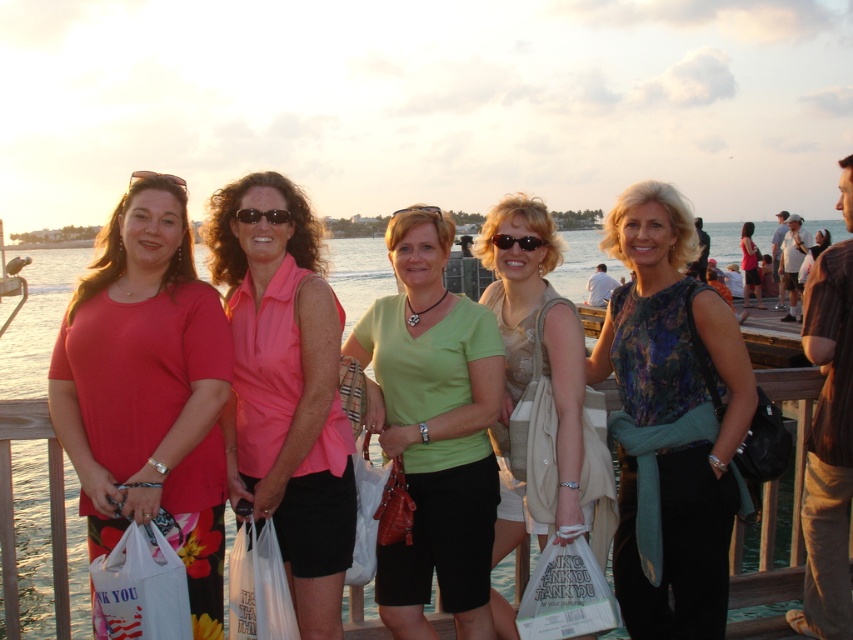
Question: Where is pink fabric shirt at center located in relation to sunglasses at center in the image?

Choices:
 (A) above
 (B) below

Answer: (B)

Question: Which point is closer to the camera?

Choices:
 (A) floral print blouse at center
 (B) matte pink shirt at center

Answer: (B)

Question: Does white plastic bag at lower center appear on the left side of clear plastic goggles at center?

Choices:
 (A) no
 (B) yes

Answer: (A)

Question: Which object is positioned farthest from the pink fabric shirt at center?

Choices:
 (A) clear water at center
 (B) floral print blouse at center

Answer: (A)

Question: Is matte pink blouse at center to the right of sunglasses at center from the viewer's perspective?

Choices:
 (A) no
 (B) yes

Answer: (B)

Question: Which object is positioned farthest from the gold metallic goggles at upper center?

Choices:
 (A) sunglasses at center
 (B) white plastic bag at lower left

Answer: (B)